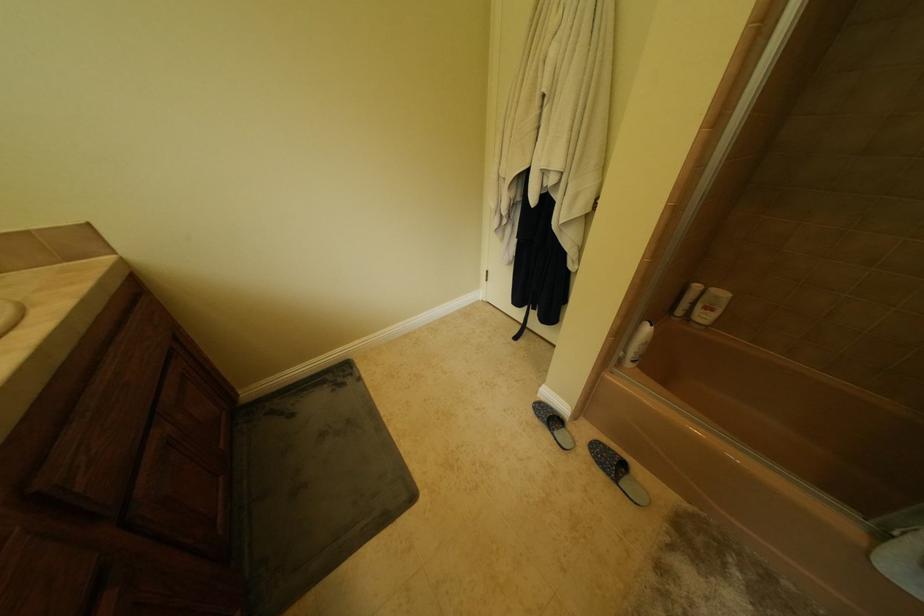
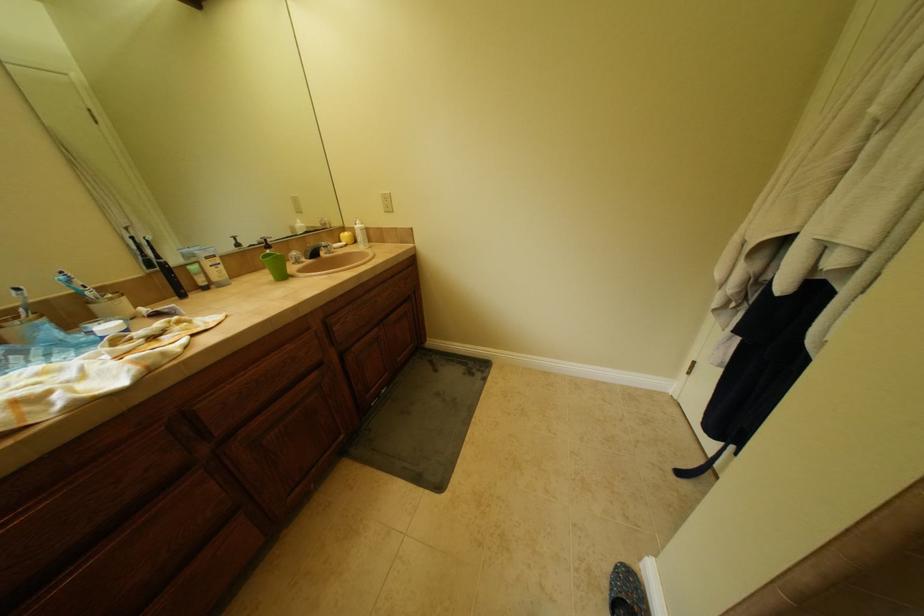
Question: The images are taken continuously from a first-person perspective. In which direction is your viewpoint rotating?

Choices:
 (A) Left
 (B) Right
 (C) Up
 (D) Down

Answer: (A)